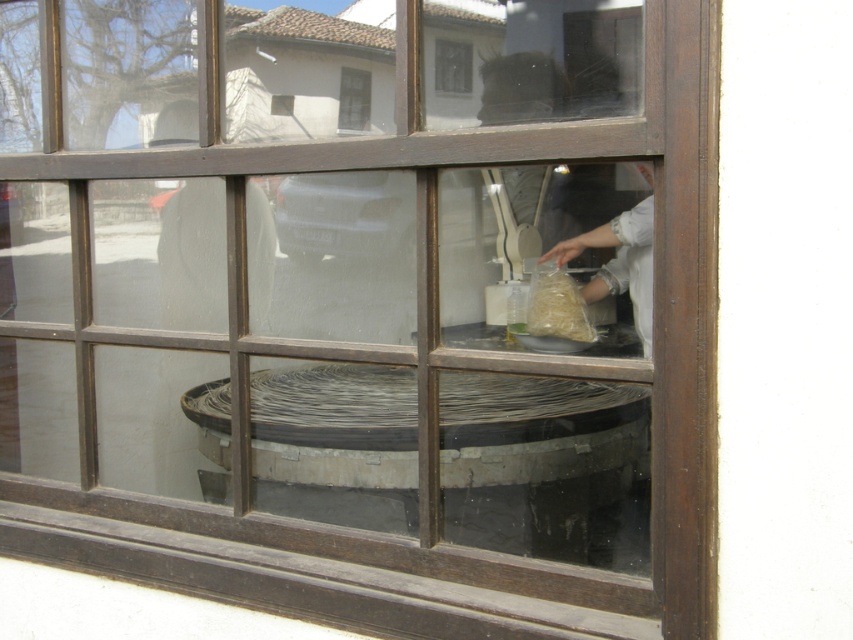
Question: Is white fabric at center closer to the viewer compared to translucent paper bag at center?

Choices:
 (A) yes
 (B) no

Answer: (A)

Question: Which object is the farthest from the white fabric at center?

Choices:
 (A) transparent glass at center
 (B) translucent paper bag at center
 (C) transparent glass window at center

Answer: (A)

Question: In this image, where is translucent paper bag at center located relative to transparent glass at center?

Choices:
 (A) below
 (B) above

Answer: (A)

Question: Is white fabric at center bigger than translucent paper bag at center?

Choices:
 (A) no
 (B) yes

Answer: (B)

Question: Which point is farther to the camera?

Choices:
 (A) (459, 84)
 (B) (550, 316)
 (C) (354, 68)

Answer: (B)

Question: Which point is farther to the camera?

Choices:
 (A) transparent glass window at center
 (B) white fabric at center
 (C) transparent glass at center
 (D) translucent paper bag at center

Answer: (D)